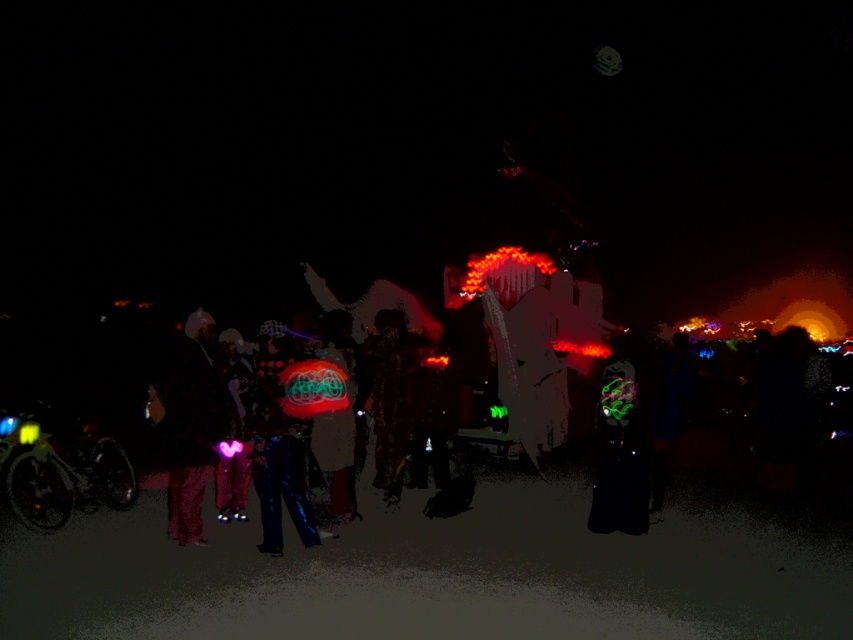
Between pink fabric at center and shiny blue pants at center, which one has more height?

pink fabric at center is taller.

Between point (158, 390) and point (250, 426), which one is positioned in front?

Point (250, 426) is in front.

Image resolution: width=853 pixels, height=640 pixels. What do you see at coordinates (190, 424) in the screenshot?
I see `pink fabric at center` at bounding box center [190, 424].

Find the location of a particular element. pink fabric at center is located at coordinates (190, 424).